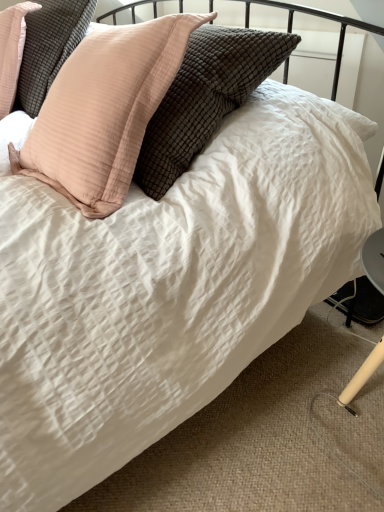
The height and width of the screenshot is (512, 384). Find the location of `matte pink pillow at upper left, which is counted as the 2th pillow, starting from the left`. matte pink pillow at upper left, which is counted as the 2th pillow, starting from the left is located at coordinates (104, 111).

In order to face matte pink pillow at upper left, marked as the 1th pillow in a right-to-left arrangement, should I rotate leftwards or rightwards?

It's best to rotate left around 12.347 degrees.

This screenshot has height=512, width=384. Describe the element at coordinates (104, 111) in the screenshot. I see `matte pink pillow at upper left, marked as the 1th pillow in a right-to-left arrangement` at that location.

What do you see at coordinates (49, 47) in the screenshot? This screenshot has width=384, height=512. I see `peach striped pillow at upper left, which appears as the first pillow when viewed from the left` at bounding box center [49, 47].

Where is `peach striped pillow at upper left, acting as the 2th pillow starting from the right`? peach striped pillow at upper left, acting as the 2th pillow starting from the right is located at coordinates (49, 47).

Locate an element on the screen. matte pink pillow at upper left, marked as the 1th pillow in a right-to-left arrangement is located at coordinates (104, 111).

In the image, is peach striped pillow at upper left, acting as the 2th pillow starting from the right, on the left side or the right side of matte pink pillow at upper left, which is counted as the 2th pillow, starting from the left?

In the image, peach striped pillow at upper left, acting as the 2th pillow starting from the right, appears on the left side of matte pink pillow at upper left, which is counted as the 2th pillow, starting from the left.

From the picture: Considering the positions of objects peach striped pillow at upper left, acting as the 2th pillow starting from the right, and matte pink pillow at upper left, which is counted as the 2th pillow, starting from the left, in the image provided, who is in front, peach striped pillow at upper left, acting as the 2th pillow starting from the right, or matte pink pillow at upper left, which is counted as the 2th pillow, starting from the left,?

matte pink pillow at upper left, which is counted as the 2th pillow, starting from the left, is in front.

Considering the points (37, 103) and (58, 143), which point is behind, point (37, 103) or point (58, 143)?

The point (37, 103) is behind.

From the image's perspective, does peach striped pillow at upper left, which appears as the first pillow when viewed from the left, appear lower than matte pink pillow at upper left, marked as the 1th pillow in a right-to-left arrangement?

Actually, peach striped pillow at upper left, which appears as the first pillow when viewed from the left, appears above matte pink pillow at upper left, marked as the 1th pillow in a right-to-left arrangement, in the image.

Based on the photo, from a real-world perspective, which object rests below the other?

matte pink pillow at upper left, which is counted as the 2th pillow, starting from the left.

Considering the sizes of objects peach striped pillow at upper left, acting as the 2th pillow starting from the right, and matte pink pillow at upper left, marked as the 1th pillow in a right-to-left arrangement, in the image provided, who is thinner, peach striped pillow at upper left, acting as the 2th pillow starting from the right, or matte pink pillow at upper left, marked as the 1th pillow in a right-to-left arrangement,?

With smaller width is matte pink pillow at upper left, marked as the 1th pillow in a right-to-left arrangement.

Does peach striped pillow at upper left, which appears as the first pillow when viewed from the left, have a lesser height compared to matte pink pillow at upper left, which is counted as the 2th pillow, starting from the left?

Yes.

Considering the relative sizes of peach striped pillow at upper left, which appears as the first pillow when viewed from the left, and matte pink pillow at upper left, marked as the 1th pillow in a right-to-left arrangement, in the image provided, is peach striped pillow at upper left, which appears as the first pillow when viewed from the left, smaller than matte pink pillow at upper left, marked as the 1th pillow in a right-to-left arrangement,?

Indeed, peach striped pillow at upper left, which appears as the first pillow when viewed from the left, has a smaller size compared to matte pink pillow at upper left, marked as the 1th pillow in a right-to-left arrangement.

Is peach striped pillow at upper left, acting as the 2th pillow starting from the right, outside of matte pink pillow at upper left, marked as the 1th pillow in a right-to-left arrangement?

Indeed, peach striped pillow at upper left, acting as the 2th pillow starting from the right, is completely outside matte pink pillow at upper left, marked as the 1th pillow in a right-to-left arrangement.

Is peach striped pillow at upper left, which appears as the first pillow when viewed from the left, far away from matte pink pillow at upper left, marked as the 1th pillow in a right-to-left arrangement?

No, there isn't a large distance between peach striped pillow at upper left, which appears as the first pillow when viewed from the left, and matte pink pillow at upper left, marked as the 1th pillow in a right-to-left arrangement.

Is peach striped pillow at upper left, which appears as the first pillow when viewed from the left, facing away from matte pink pillow at upper left, marked as the 1th pillow in a right-to-left arrangement?

No.

The image size is (384, 512). Find the location of `pillow in front of the peach striped pillow at upper left, acting as the 2th pillow starting from the right`. pillow in front of the peach striped pillow at upper left, acting as the 2th pillow starting from the right is located at coordinates (104, 111).

Which is more to the left, matte pink pillow at upper left, which is counted as the 2th pillow, starting from the left, or peach striped pillow at upper left, acting as the 2th pillow starting from the right?

peach striped pillow at upper left, acting as the 2th pillow starting from the right.

Considering the positions of objects matte pink pillow at upper left, which is counted as the 2th pillow, starting from the left, and peach striped pillow at upper left, which appears as the first pillow when viewed from the left, in the image provided, who is in front, matte pink pillow at upper left, which is counted as the 2th pillow, starting from the left, or peach striped pillow at upper left, which appears as the first pillow when viewed from the left,?

matte pink pillow at upper left, which is counted as the 2th pillow, starting from the left, is more forward.

Does point (62, 155) come behind point (58, 31)?

That is False.

From the image's perspective, which one is positioned higher, matte pink pillow at upper left, marked as the 1th pillow in a right-to-left arrangement, or peach striped pillow at upper left, acting as the 2th pillow starting from the right?

peach striped pillow at upper left, acting as the 2th pillow starting from the right.

From a real-world perspective, does matte pink pillow at upper left, marked as the 1th pillow in a right-to-left arrangement, sit lower than peach striped pillow at upper left, acting as the 2th pillow starting from the right?

Yes, from a real-world perspective, matte pink pillow at upper left, marked as the 1th pillow in a right-to-left arrangement, is under peach striped pillow at upper left, acting as the 2th pillow starting from the right.

From the picture: Between matte pink pillow at upper left, marked as the 1th pillow in a right-to-left arrangement, and peach striped pillow at upper left, acting as the 2th pillow starting from the right, which one has smaller width?

matte pink pillow at upper left, marked as the 1th pillow in a right-to-left arrangement.

Is matte pink pillow at upper left, marked as the 1th pillow in a right-to-left arrangement, taller than peach striped pillow at upper left, which appears as the first pillow when viewed from the left?

Correct, matte pink pillow at upper left, marked as the 1th pillow in a right-to-left arrangement, is much taller as peach striped pillow at upper left, which appears as the first pillow when viewed from the left.

Considering the sizes of objects matte pink pillow at upper left, marked as the 1th pillow in a right-to-left arrangement, and peach striped pillow at upper left, which appears as the first pillow when viewed from the left, in the image provided, who is bigger, matte pink pillow at upper left, marked as the 1th pillow in a right-to-left arrangement, or peach striped pillow at upper left, which appears as the first pillow when viewed from the left,?

matte pink pillow at upper left, marked as the 1th pillow in a right-to-left arrangement, is bigger.

Is matte pink pillow at upper left, marked as the 1th pillow in a right-to-left arrangement, situated inside peach striped pillow at upper left, acting as the 2th pillow starting from the right, or outside?

matte pink pillow at upper left, marked as the 1th pillow in a right-to-left arrangement, is not inside peach striped pillow at upper left, acting as the 2th pillow starting from the right, it's outside.

Is matte pink pillow at upper left, which is counted as the 2th pillow, starting from the left, far from peach striped pillow at upper left, which appears as the first pillow when viewed from the left?

No, matte pink pillow at upper left, which is counted as the 2th pillow, starting from the left, is in close proximity to peach striped pillow at upper left, which appears as the first pillow when viewed from the left.

Is matte pink pillow at upper left, which is counted as the 2th pillow, starting from the left, facing away from peach striped pillow at upper left, acting as the 2th pillow starting from the right?

That's not correct — matte pink pillow at upper left, which is counted as the 2th pillow, starting from the left, is not looking away from peach striped pillow at upper left, acting as the 2th pillow starting from the right.

Where is `pillow that appears above the matte pink pillow at upper left, marked as the 1th pillow in a right-to-left arrangement (from a real-world perspective)`? The image size is (384, 512). pillow that appears above the matte pink pillow at upper left, marked as the 1th pillow in a right-to-left arrangement (from a real-world perspective) is located at coordinates (49, 47).

The width and height of the screenshot is (384, 512). Identify the location of pillow behind the matte pink pillow at upper left, marked as the 1th pillow in a right-to-left arrangement. (49, 47).

The width and height of the screenshot is (384, 512). I want to click on pillow below the peach striped pillow at upper left, acting as the 2th pillow starting from the right (from a real-world perspective), so click(104, 111).